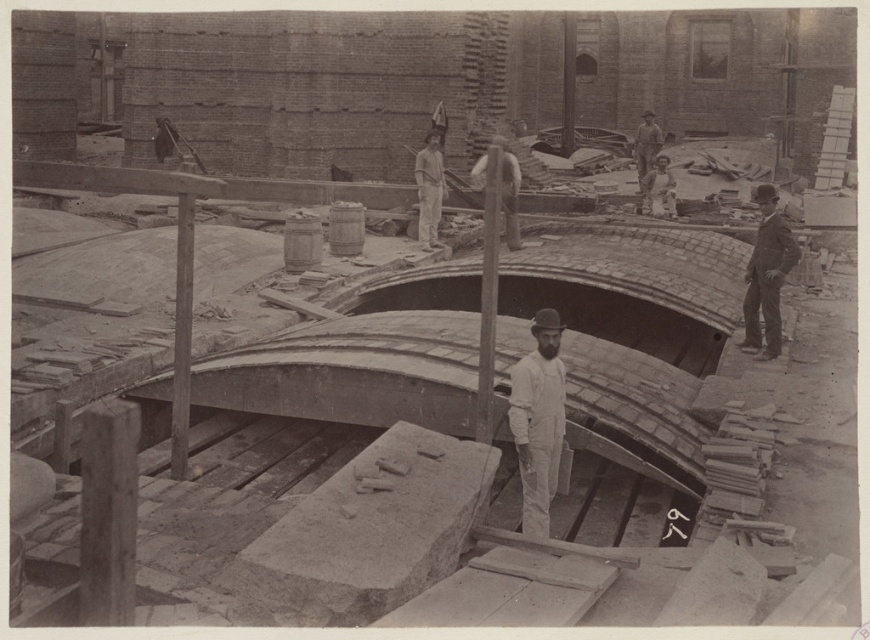
Who is taller, smooth wooden pole at center or smooth white shirt at center?

With more height is smooth white shirt at center.

You are a GUI agent. You are given a task and a screenshot of the screen. Output one action in this format:
    pyautogui.click(x=<x>, y=<y>)
    Task: Click on the smooth wooden pole at center
    
    Given the screenshot: What is the action you would take?
    coord(429,189)

I want to click on smooth wooden pole at center, so click(429, 189).

Does smooth black suit at right appear on the right side of smooth wooden pole at center?

Indeed, smooth black suit at right is positioned on the right side of smooth wooden pole at center.

The height and width of the screenshot is (640, 870). What do you see at coordinates (766, 275) in the screenshot?
I see `smooth black suit at right` at bounding box center [766, 275].

Where is `smooth black suit at right`? The height and width of the screenshot is (640, 870). smooth black suit at right is located at coordinates (766, 275).

What do you see at coordinates (658, 188) in the screenshot? The width and height of the screenshot is (870, 640). I see `light brown wooden crate at upper right` at bounding box center [658, 188].

Who is taller, light brown wooden crate at upper right or smooth brown hat at upper right?

smooth brown hat at upper right is taller.

Locate an element on the screen. light brown wooden crate at upper right is located at coordinates (658, 188).

Find the location of a particular element. light brown wooden crate at upper right is located at coordinates (658, 188).